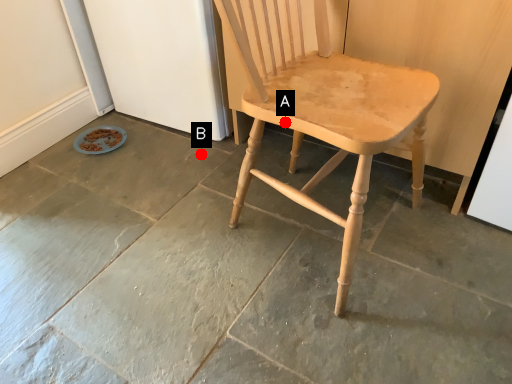
Question: Two points are circled on the image, labeled by A and B beside each circle. Which point is closer to the camera taking this photo?

Choices:
 (A) A is closer
 (B) B is closer

Answer: (A)